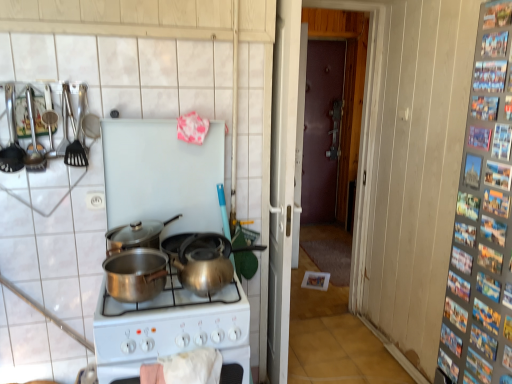
Question: Does shiny silver wok at center come behind shiny silver pot at center, which is the third kitchen appliance from left to right?

Choices:
 (A) yes
 (B) no

Answer: (A)

Question: Is shiny silver pot at center, acting as the second kitchen appliance starting from the right, at the back of shiny silver wok at center?

Choices:
 (A) yes
 (B) no

Answer: (B)

Question: From the image's perspective, is shiny silver wok at center below shiny silver pot at center, acting as the second kitchen appliance starting from the right?

Choices:
 (A) no
 (B) yes

Answer: (B)

Question: Does shiny silver wok at center have a greater height compared to shiny silver pot at center, which is the third kitchen appliance from left to right?

Choices:
 (A) yes
 (B) no

Answer: (B)

Question: Is shiny silver wok at center in front of shiny silver pot at center, which is the third kitchen appliance from left to right?

Choices:
 (A) no
 (B) yes

Answer: (A)

Question: Would you say dark brown wood door at center is to the left or to the right of shiny metallic kettle at center in the picture?

Choices:
 (A) left
 (B) right

Answer: (B)

Question: In terms of height, does dark brown wood door at center look taller or shorter compared to shiny metallic kettle at center?

Choices:
 (A) short
 (B) tall

Answer: (B)

Question: From the image's perspective, is dark brown wood door at center above or below shiny metallic kettle at center?

Choices:
 (A) below
 (B) above

Answer: (B)

Question: From a real-world perspective, relative to shiny metallic kettle at center, is dark brown wood door at center vertically above or below?

Choices:
 (A) below
 (B) above

Answer: (B)

Question: From a real-world perspective, relative to shiny silver wok at center, is polished stainless steel pot at center, the fourth kitchen appliance from the left, vertically above or below?

Choices:
 (A) above
 (B) below

Answer: (A)

Question: In terms of width, does polished stainless steel pot at center, which is the 1th kitchen appliance from right to left, look wider or thinner when compared to shiny silver wok at center?

Choices:
 (A) thin
 (B) wide

Answer: (B)

Question: Is polished stainless steel pot at center, which is the 1th kitchen appliance from right to left, in front of or behind shiny silver wok at center in the image?

Choices:
 (A) front
 (B) behind

Answer: (A)

Question: Considering the positions of point 130,292 and point 175,249, is point 130,292 closer or farther from the camera than point 175,249?

Choices:
 (A) farther
 (B) closer

Answer: (B)

Question: Is shiny silver wok at center to the left or to the right of shiny silver pot at center, which is the third kitchen appliance from left to right, in the image?

Choices:
 (A) right
 (B) left

Answer: (A)

Question: Looking at their shapes, would you say shiny silver wok at center is wider or thinner than shiny silver pot at center, which is the third kitchen appliance from left to right?

Choices:
 (A) wide
 (B) thin

Answer: (B)